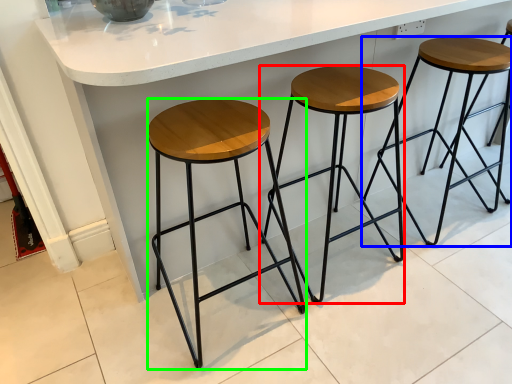
Question: Considering the real-world distances, which object is closest to stool (highlighted by a red box)? stool (highlighted by a blue box) or stool (highlighted by a green box).

Choices:
 (A) stool
 (B) stool

Answer: (B)